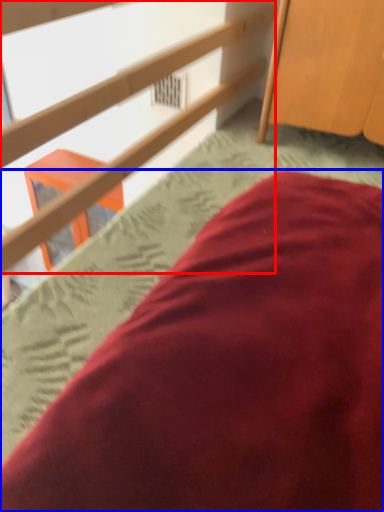
Question: Which object is closer to the camera taking this photo, rail (highlighted by a red box) or bed (highlighted by a blue box)?

Choices:
 (A) rail
 (B) bed

Answer: (A)